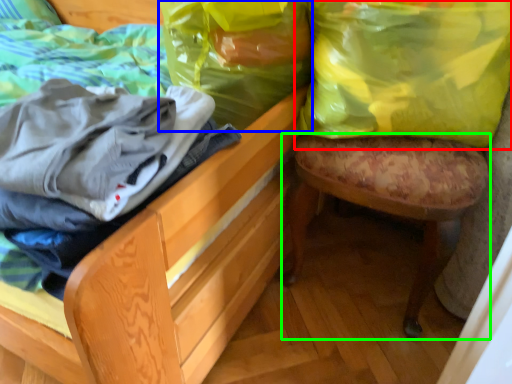
Question: Estimate the real-world distances between objects in this image. Which object is farther from shopping bag (highlighted by a red box), shopping bag (highlighted by a blue box) or stool (highlighted by a green box)?

Choices:
 (A) shopping bag
 (B) stool

Answer: (A)